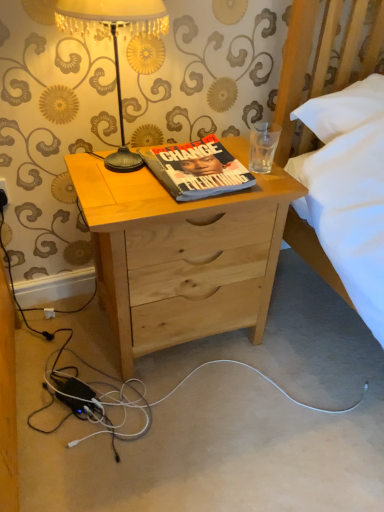
Question: Looking at their shapes, would you say hardcover book at center is wider or thinner than natural wood nightstand at center?

Choices:
 (A) thin
 (B) wide

Answer: (A)

Question: In terms of height, does hardcover book at center look taller or shorter compared to natural wood nightstand at center?

Choices:
 (A) tall
 (B) short

Answer: (B)

Question: Considering the real-world distances, which object is closest to the hardcover book at center?

Choices:
 (A) natural wood nightstand at center
 (B) gold textured lampshade at upper left

Answer: (A)

Question: Considering the real-world distances, which object is closest to the gold textured lampshade at upper left?

Choices:
 (A) natural wood nightstand at center
 (B) hardcover book at center

Answer: (B)